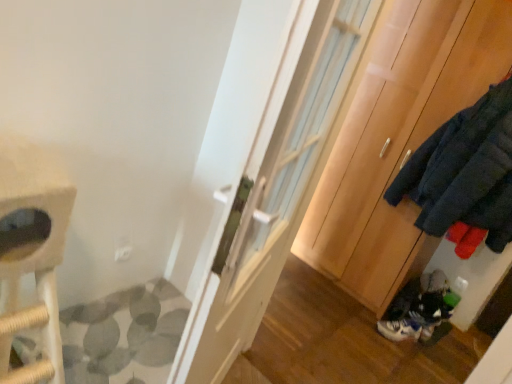
Question: From a real-world perspective, relative to white leather sneaker at lower right, is wooden cabinet at right vertically above or below?

Choices:
 (A) below
 (B) above

Answer: (B)

Question: Considering the positions of wooden cabinet at right and white leather sneaker at lower right in the image, is wooden cabinet at right bigger or smaller than white leather sneaker at lower right?

Choices:
 (A) big
 (B) small

Answer: (A)

Question: Based on their relative distances, which object is farther from the white leather sneaker at lower right?

Choices:
 (A) wooden cabinet at right
 (B) white glossy door at center

Answer: (B)

Question: Which object is the closest to the white leather sneaker at lower right?

Choices:
 (A) wooden cabinet at right
 (B) white glossy door at center

Answer: (A)